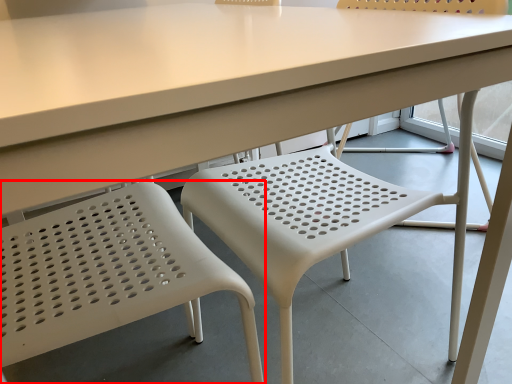
Question: From the image's perspective, considering the relative positions of chair (annotated by the red box) and chair in the image provided, where is chair (annotated by the red box) located with respect to the staircase?

Choices:
 (A) below
 (B) above

Answer: (A)